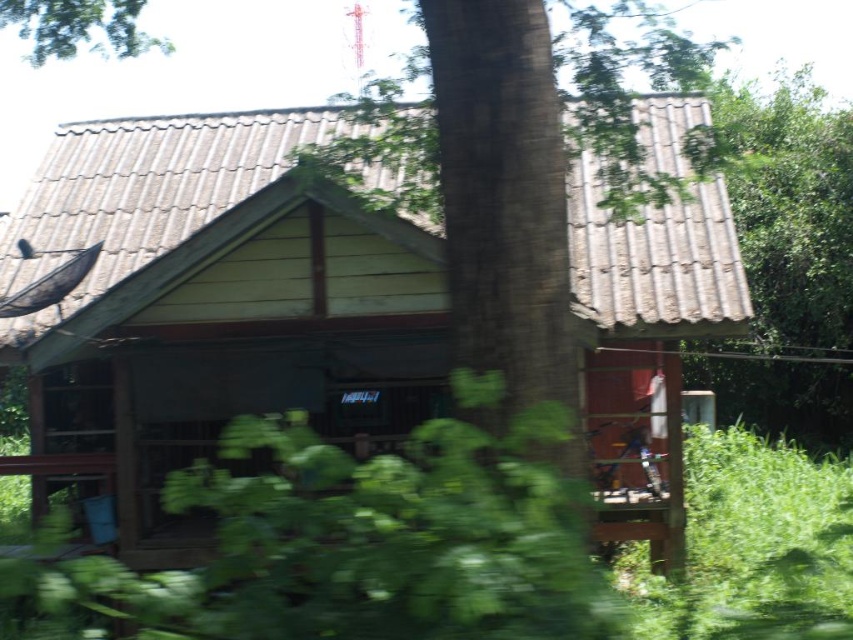
Who is higher up, wooden cabin at center or green leafy tree at upper right?

green leafy tree at upper right is above.

Is wooden cabin at center to the left of green leafy tree at upper right from the viewer's perspective?

Yes, wooden cabin at center is to the left of green leafy tree at upper right.

Locate an element on the screen. The image size is (853, 640). wooden cabin at center is located at coordinates (213, 307).

Locate an element on the screen. The image size is (853, 640). wooden cabin at center is located at coordinates (213, 307).

Can you confirm if wooden cabin at center is positioned below green leafy tree at upper left?

Yes.

Between wooden cabin at center and green leafy tree at upper left, which one is positioned higher?

green leafy tree at upper left is higher up.

The width and height of the screenshot is (853, 640). Identify the location of wooden cabin at center. (213, 307).

Is point (547, 556) more distant than point (6, 22)?

No, (547, 556) is in front of (6, 22).

Where is `green leafy plant at center`? green leafy plant at center is located at coordinates (350, 547).

Locate an element on the screen. This screenshot has width=853, height=640. green leafy plant at center is located at coordinates (350, 547).